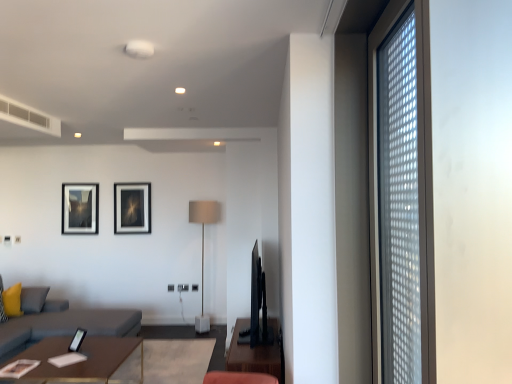
Question: Does brown wooden table at center, positioned as the 2th table in left-to-right order, appear on the right side of gray fabric couch at left?

Choices:
 (A) no
 (B) yes

Answer: (B)

Question: From a real-world perspective, is brown wooden table at center, positioned as the 2th table in left-to-right order, physically above gray fabric couch at left?

Choices:
 (A) no
 (B) yes

Answer: (A)

Question: From the image's perspective, is brown wooden table at center, marked as the first table in a right-to-left arrangement, under gray fabric couch at left?

Choices:
 (A) no
 (B) yes

Answer: (B)

Question: Is brown wooden table at center, marked as the first table in a right-to-left arrangement, with gray fabric couch at left?

Choices:
 (A) no
 (B) yes

Answer: (A)

Question: Does brown wooden table at center, marked as the first table in a right-to-left arrangement, lie behind gray fabric couch at left?

Choices:
 (A) no
 (B) yes

Answer: (A)

Question: Is brown wooden table at center, marked as the first table in a right-to-left arrangement, smaller than gray fabric couch at left?

Choices:
 (A) yes
 (B) no

Answer: (A)

Question: From a real-world perspective, is yellow fabric pillow at lower left located beneath gray fabric couch at left?

Choices:
 (A) no
 (B) yes

Answer: (A)

Question: Could you tell me if yellow fabric pillow at lower left is facing gray fabric couch at left?

Choices:
 (A) yes
 (B) no

Answer: (A)

Question: Considering the relative sizes of yellow fabric pillow at lower left and gray fabric couch at left in the image provided, is yellow fabric pillow at lower left shorter than gray fabric couch at left?

Choices:
 (A) yes
 (B) no

Answer: (A)

Question: Does yellow fabric pillow at lower left have a greater width compared to gray fabric couch at left?

Choices:
 (A) yes
 (B) no

Answer: (B)

Question: Is yellow fabric pillow at lower left not close to gray fabric couch at left?

Choices:
 (A) yes
 (B) no

Answer: (B)

Question: Does yellow fabric pillow at lower left have a larger size compared to gray fabric couch at left?

Choices:
 (A) yes
 (B) no

Answer: (B)

Question: Is gray fabric couch at left shorter than wooden table at lower left, the 1th table when ordered from left to right?

Choices:
 (A) yes
 (B) no

Answer: (B)